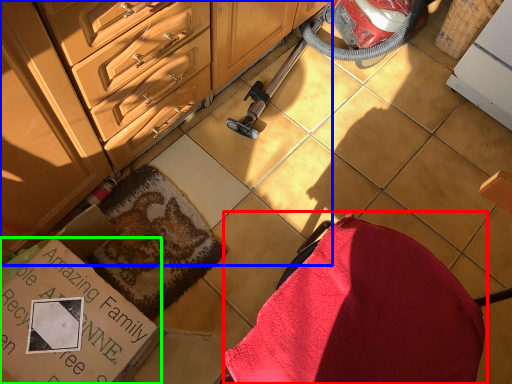
Question: Which is farther away from swivel chair (highlighted by a red box)? cabinetry (highlighted by a blue box) or cardboard box (highlighted by a green box)?

Choices:
 (A) cabinetry
 (B) cardboard box

Answer: (A)